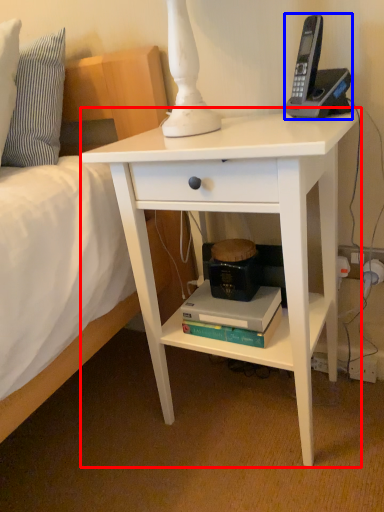
Question: Which object is further to the camera taking this photo, desk (highlighted by a red box) or corded phone (highlighted by a blue box)?

Choices:
 (A) desk
 (B) corded phone

Answer: (B)